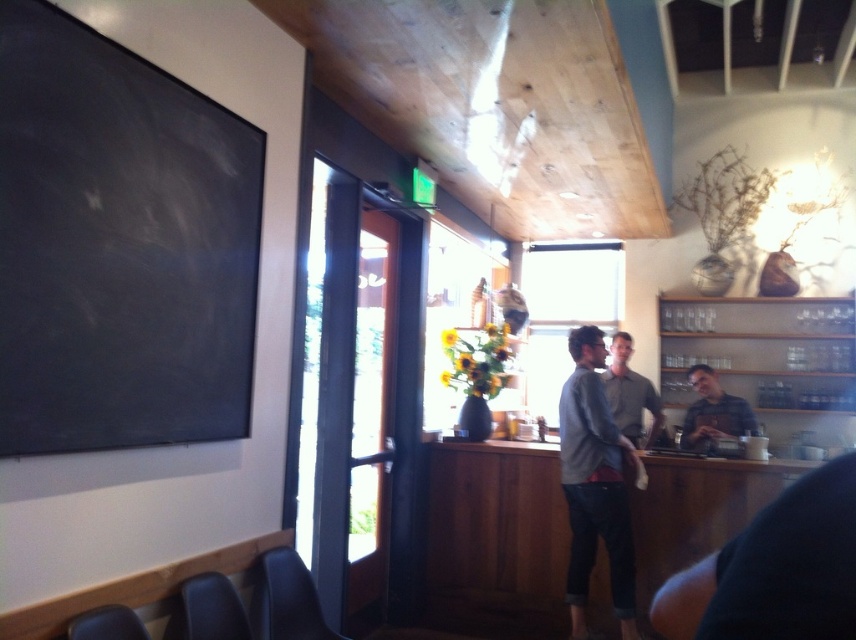
Measure the distance between gray cotton sweater at center and camera.

The distance of gray cotton sweater at center from camera is 11.55 feet.

The height and width of the screenshot is (640, 856). I want to click on gray cotton sweater at center, so click(x=595, y=484).

What are the coordinates of `gray cotton sweater at center` in the screenshot? It's located at (595, 484).

Between point (24, 300) and point (572, 625), which one is positioned behind?

The point (572, 625) is more distant.

Between black chalkboard at upper left and gray cotton sweater at center, which one is positioned lower?

gray cotton sweater at center

Image resolution: width=856 pixels, height=640 pixels. Describe the element at coordinates (119, 246) in the screenshot. I see `black chalkboard at upper left` at that location.

Where is `black chalkboard at upper left`? The image size is (856, 640). black chalkboard at upper left is located at coordinates (119, 246).

Can you confirm if black chalkboard at upper left is thinner than gray sweater at center?

Indeed, black chalkboard at upper left has a lesser width compared to gray sweater at center.

Looking at this image, between black chalkboard at upper left and gray sweater at center, which one appears on the right side from the viewer's perspective?

gray sweater at center

Is point (3, 433) more distant than point (637, 440)?

No, it is not.

Identify the location of black chalkboard at upper left. The image size is (856, 640). (119, 246).